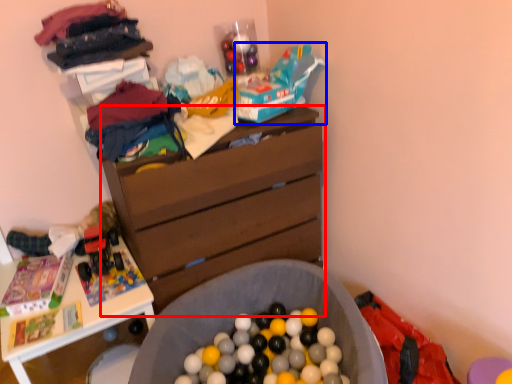
Question: Which object appears farthest to the camera in this image, chest of drawers (highlighted by a red box) or toy car (highlighted by a blue box)?

Choices:
 (A) chest of drawers
 (B) toy car

Answer: (B)